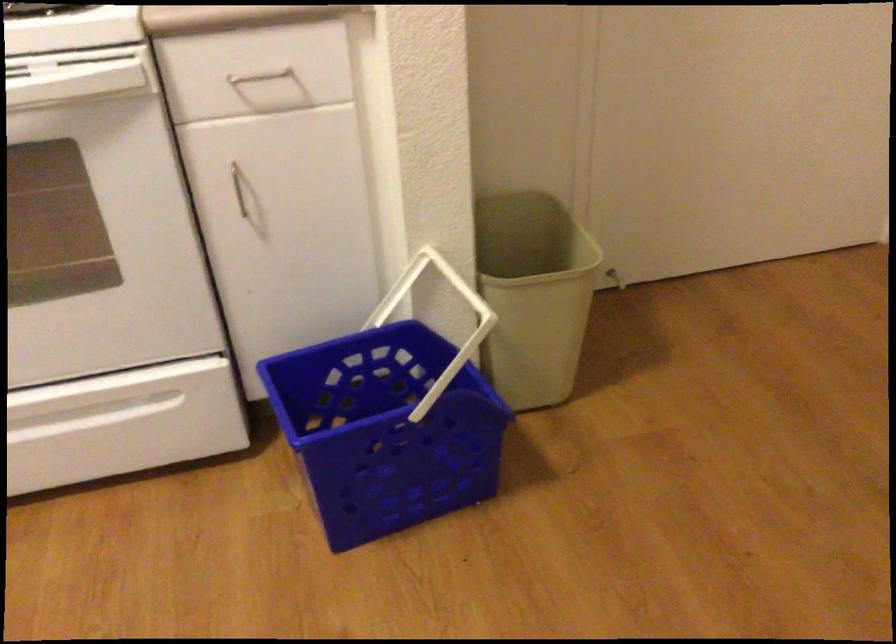
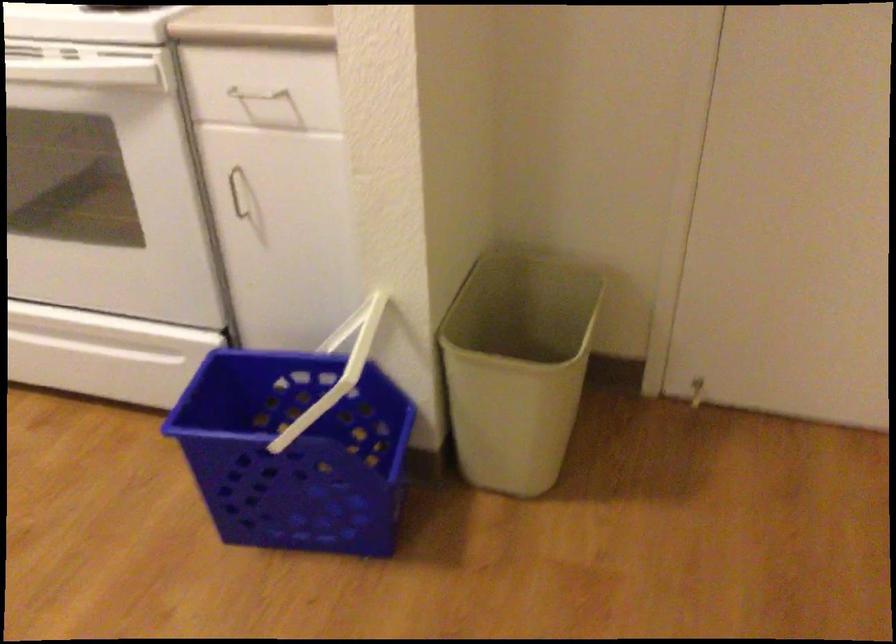
In the second image, find the point that corresponds to point 392,295 in the first image.

(346, 328)